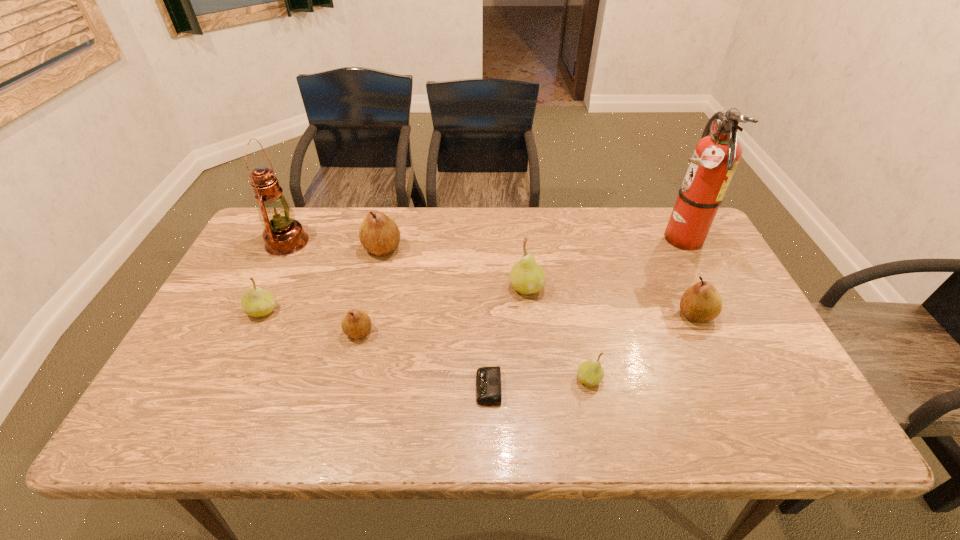
Locate an element on the screen. Image resolution: width=960 pixels, height=540 pixels. fire extinguisher is located at coordinates (716, 156).

The width and height of the screenshot is (960, 540). I want to click on the tallest object, so click(716, 156).

Image resolution: width=960 pixels, height=540 pixels. Identify the location of the second tallest object. (283, 235).

Locate an element on the screen. The width and height of the screenshot is (960, 540). the farthest pear is located at coordinates (378, 233).

At what (x,y) coordinates should I click in order to perform the action: click on the farthest brown pear. Please return your answer as a coordinate pair (x, y). This screenshot has height=540, width=960. Looking at the image, I should click on (378, 233).

Find the location of a particular element. This screenshot has height=540, width=960. the biggest green pear is located at coordinates (526, 277).

Locate an element on the screen. This screenshot has width=960, height=540. the third pear from right to left is located at coordinates (526, 277).

Find the location of `the second biggest green pear`. the second biggest green pear is located at coordinates (256, 302).

Identify the location of the leftmost green pear. (256, 302).

Locate an element on the screen. the second smallest brown pear is located at coordinates (700, 303).